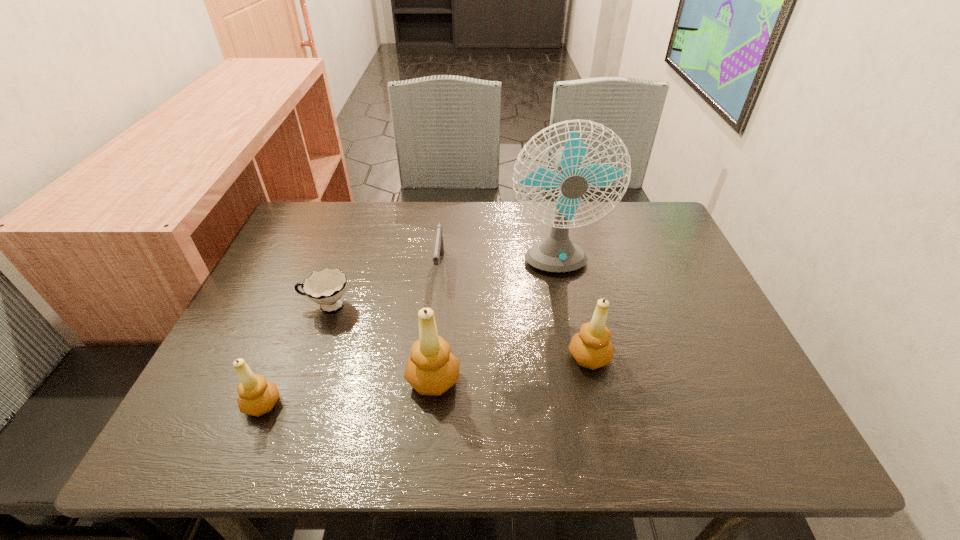
Find the location of a particular element. Image resolution: width=960 pixels, height=540 pixels. candle_holder present at the left edge is located at coordinates (257, 396).

This screenshot has height=540, width=960. Identify the location of cup situated at the left edge. (326, 287).

Identify the location of object that is at the near left corner. Image resolution: width=960 pixels, height=540 pixels. (257, 396).

Where is `vacant region at the far edge of the desktop`? This screenshot has width=960, height=540. vacant region at the far edge of the desktop is located at coordinates (356, 204).

The height and width of the screenshot is (540, 960). Find the location of `vacant area at the left edge of the desktop`. vacant area at the left edge of the desktop is located at coordinates (262, 288).

This screenshot has width=960, height=540. In order to click on vacant space at the right edge of the desktop in this screenshot , I will do `click(658, 252)`.

Where is `vacant space at the far left corner of the desktop`? The width and height of the screenshot is (960, 540). vacant space at the far left corner of the desktop is located at coordinates (307, 247).

Locate an element on the screen. Image resolution: width=960 pixels, height=540 pixels. free region at the far right corner of the desktop is located at coordinates (636, 241).

This screenshot has height=540, width=960. In order to click on vacant space at the near right corner of the desktop in this screenshot , I will do `click(765, 397)`.

This screenshot has width=960, height=540. Identify the location of empty location between the fourth nearest object and the second tallest object. (380, 343).